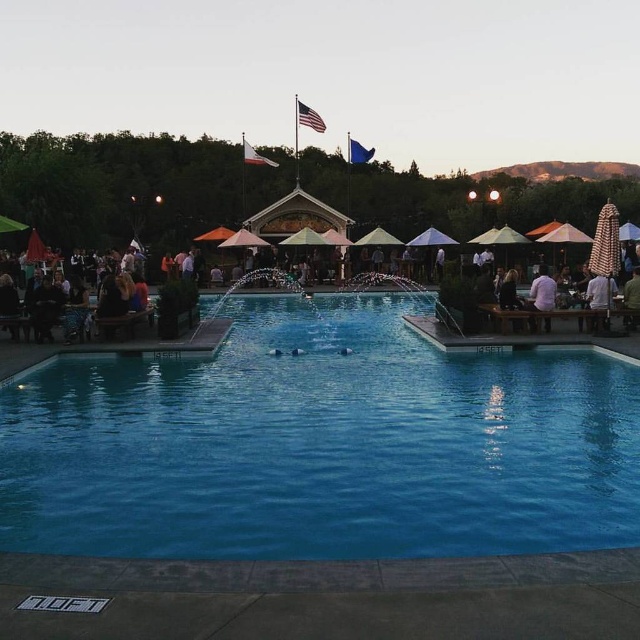
Is blue smooth pool at center below matte wooden tables at lower left?

Yes, blue smooth pool at center is below matte wooden tables at lower left.

Does blue smooth pool at center have a greater height compared to matte wooden tables at lower left?

No.

Find the location of a particular element. This screenshot has height=640, width=640. blue smooth pool at center is located at coordinates (321, 444).

Image resolution: width=640 pixels, height=640 pixels. Find the location of `blue smooth pool at center`. blue smooth pool at center is located at coordinates (321, 444).